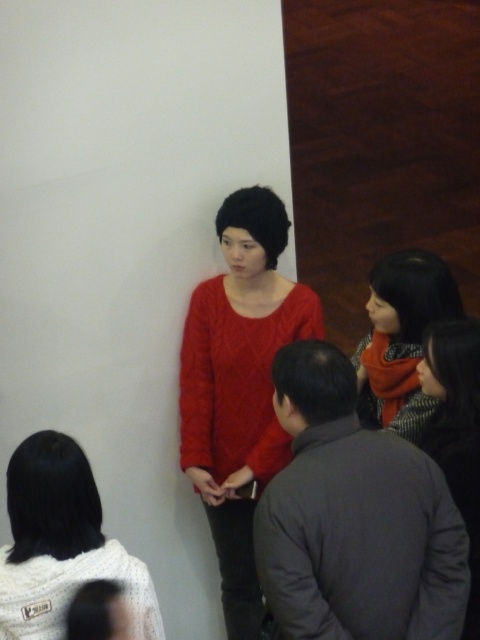
Question: Which object appears closest to the camera in this image?

Choices:
 (A) cable-knit sweater at center
 (B) white fuzzy sweater at lower left
 (C) matte red scarf at center
 (D) dark gray sweater at lower right

Answer: (B)

Question: Does cable-knit sweater at center appear on the right side of matte red scarf at center?

Choices:
 (A) no
 (B) yes

Answer: (A)

Question: Is white fuzzy sweater at lower left further to the viewer compared to dark gray sweater at lower right?

Choices:
 (A) no
 (B) yes

Answer: (A)

Question: Which object is farther from the camera taking this photo?

Choices:
 (A) matte red scarf at center
 (B) white fuzzy sweater at lower left
 (C) cable-knit sweater at center
 (D) dark gray sweater at lower right

Answer: (C)

Question: Which of the following is the closest to the observer?

Choices:
 (A) matte red scarf at center
 (B) dark gray sweater at lower right
 (C) white fuzzy sweater at lower left

Answer: (C)

Question: Is matte red scarf at center wider than dark gray sweater at lower right?

Choices:
 (A) yes
 (B) no

Answer: (A)